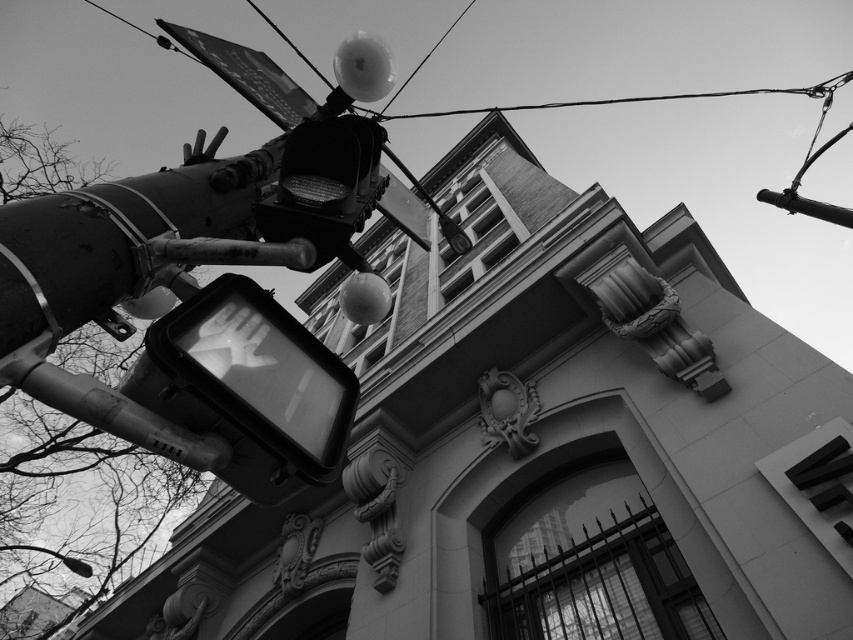
You are a photographer adjusting your camera settings to capture details of the metallic wire at upper center and the smooth metal pole at upper right. Which object should you focus on first if you want to ensure both are in sharp focus, considering their sizes?

The metallic wire at upper center is bigger than the smooth metal pole at upper right, so focusing on the metallic wire at upper center first would help ensure both are in sharp focus since it is larger and requires more precise focus.

You are a maintenance worker inspecting the traffic signal structure. You notice two components, the metallic wire at upper center and the smooth metal pole at upper right. Which component is positioned higher in the image?

The metallic wire at upper center is much taller than the smooth metal pole at upper right, so the metallic wire at upper center is positioned higher in the image.